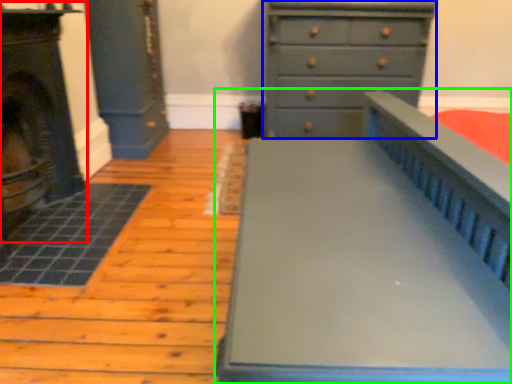
Question: Considering the real-world distances, which object is closest to fireplace (highlighted by a red box)? chest of drawers (highlighted by a blue box) or furniture (highlighted by a green box).

Choices:
 (A) chest of drawers
 (B) furniture

Answer: (B)